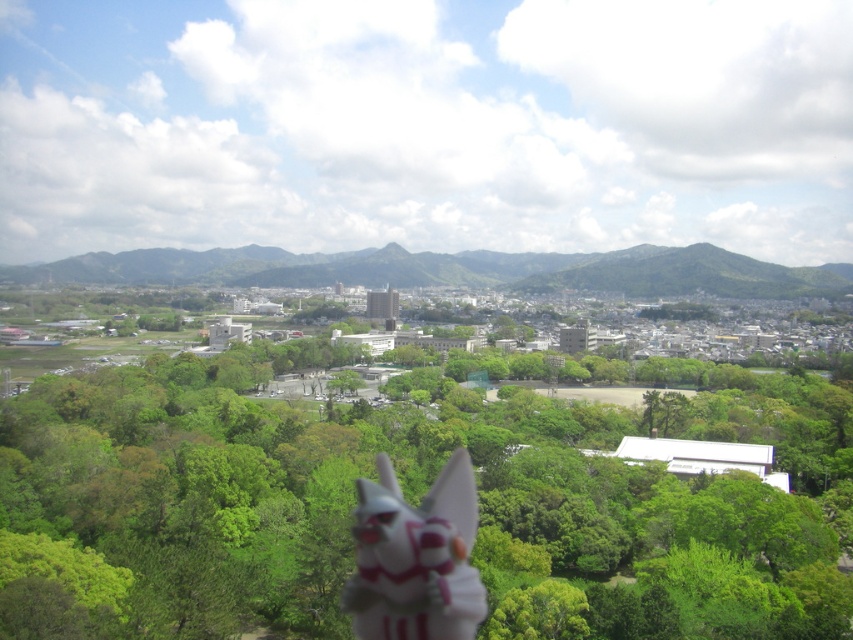
Question: Is the position of green leafy tree at center less distant than that of white glossy fox at lower center?

Choices:
 (A) yes
 (B) no

Answer: (A)

Question: Which point is farther to the camera?

Choices:
 (A) (187, 493)
 (B) (456, 531)

Answer: (A)

Question: Among these objects, which one is nearest to the camera?

Choices:
 (A) green leafy tree at center
 (B) white glossy fox at lower center

Answer: (A)

Question: Among these objects, which one is farthest from the camera?

Choices:
 (A) green leafy tree at center
 (B) white glossy fox at lower center

Answer: (B)

Question: Can you confirm if green leafy tree at center is positioned below white glossy fox at lower center?

Choices:
 (A) yes
 (B) no

Answer: (B)

Question: Is green leafy tree at center closer to the viewer compared to white glossy fox at lower center?

Choices:
 (A) yes
 (B) no

Answer: (A)